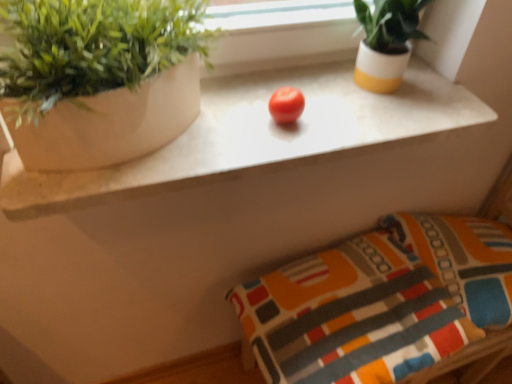
Question: Considering the relative positions of white marble counter at center and textured fabric pillow at lower right, acting as the 2th pillow starting from the right, in the image provided, is white marble counter at center to the left or to the right of textured fabric pillow at lower right, acting as the 2th pillow starting from the right,?

Choices:
 (A) left
 (B) right

Answer: (A)

Question: From the image's perspective, is white marble counter at center positioned above or below textured fabric pillow at lower right, acting as the 2th pillow starting from the right?

Choices:
 (A) above
 (B) below

Answer: (A)

Question: Considering the real-world distances, which object is farthest from the white marble counter at center?

Choices:
 (A) red matte tomato at center
 (B) textured fabric pillow at lower right, acting as the 2th pillow starting from the right
 (C) matte white pot at upper left
 (D) white glossy pot at upper right
 (E) textured cotton pillow at lower right, acting as the first pillow starting from the right

Answer: (E)

Question: Which object is the closest to the textured cotton pillow at lower right, acting as the first pillow starting from the right?

Choices:
 (A) matte white pot at upper left
 (B) white glossy pot at upper right
 (C) red matte tomato at center
 (D) textured fabric pillow at lower right, acting as the 2th pillow starting from the right
 (E) white marble counter at center

Answer: (D)